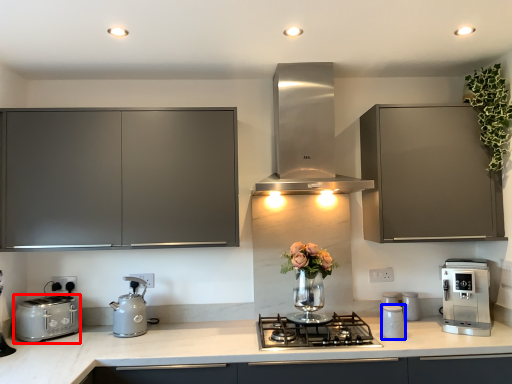
Question: Which of the following is the farthest to the observer, toaster (highlighted by a red box) or kitchen appliance (highlighted by a blue box)?

Choices:
 (A) toaster
 (B) kitchen appliance

Answer: (B)